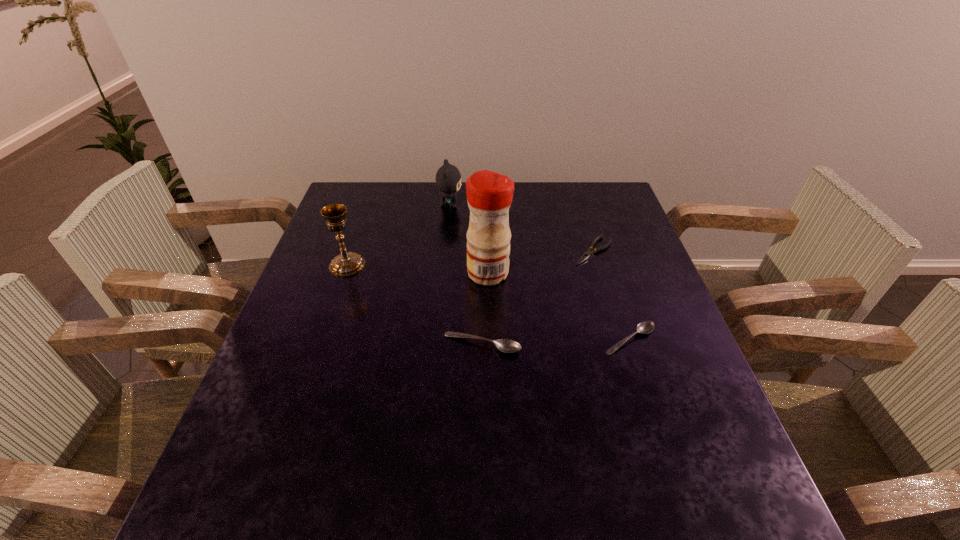
The image size is (960, 540). I want to click on vacant region between the kitten and the taller soupspoon, so click(466, 275).

The height and width of the screenshot is (540, 960). What are the coordinates of `empty space that is in between the third tallest object and the pliers` in the screenshot? It's located at (521, 228).

Locate an element on the screen. Image resolution: width=960 pixels, height=540 pixels. vacant region between the pliers and the farthest object is located at coordinates (521, 228).

Where is `free point between the shorter soupspoon and the third shortest object`? free point between the shorter soupspoon and the third shortest object is located at coordinates (556, 342).

Select which object appears as the closest to the shorter soupspoon. Please provide its 2D coordinates. Your answer should be formatted as a tuple, i.e. [(x, y)], where the tuple contains the x and y coordinates of a point satisfying the conditions above.

[(504, 345)]

Locate which object is the fourth closest to the kitten. Please provide its 2D coordinates. Your answer should be formatted as a tuple, i.e. [(x, y)], where the tuple contains the x and y coordinates of a point satisfying the conditions above.

[(504, 345)]

Find the location of a particular element. free space in the image that satisfies the following two spatial constraints: 1. on the front-facing side of the kitten; 2. on the back side of the fourth tallest object is located at coordinates (437, 344).

Locate an element on the screen. The image size is (960, 540). vacant space that satisfies the following two spatial constraints: 1. on the front-facing side of the kitten; 2. on the right side of the pliers is located at coordinates (445, 251).

Identify the location of vacant area that satisfies the following two spatial constraints: 1. on the back side of the left soupspoon; 2. on the left side of the condiment. (482, 273).

You are a GUI agent. You are given a task and a screenshot of the screen. Output one action in this format:
    pyautogui.click(x=<x>, y=<y>)
    Task: Click on the free space in the image that satisfies the following two spatial constraints: 1. on the back side of the fourth tallest object; 2. on the right side of the pliers
    The image size is (960, 540).
    Given the screenshot: What is the action you would take?
    pyautogui.click(x=482, y=251)